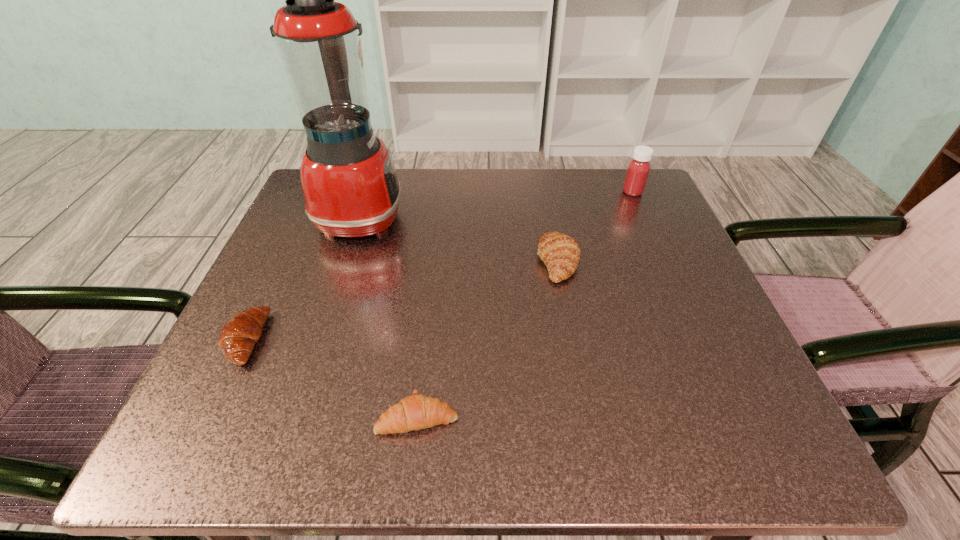
Image resolution: width=960 pixels, height=540 pixels. Identify the location of the tallest object. (349, 182).

Where is `medicine`? The height and width of the screenshot is (540, 960). medicine is located at coordinates (638, 169).

In order to click on the second tallest object in this screenshot , I will do `click(638, 169)`.

Image resolution: width=960 pixels, height=540 pixels. In order to click on the third shortest object in this screenshot , I will do `click(560, 253)`.

You are a GUI agent. You are given a task and a screenshot of the screen. Output one action in this format:
    pyautogui.click(x=<x>, y=<y>)
    Task: Click on the rightmost crescent roll
    The image size is (960, 540).
    Given the screenshot: What is the action you would take?
    click(560, 253)

Identify the location of the leftmost crescent roll. Image resolution: width=960 pixels, height=540 pixels. (240, 333).

You are a GUI agent. You are given a task and a screenshot of the screen. Output one action in this format:
    pyautogui.click(x=<x>, y=<y>)
    Task: Click on the second farthest crescent roll
    This screenshot has height=540, width=960.
    Given the screenshot: What is the action you would take?
    pyautogui.click(x=240, y=333)

Where is `the second crescent roll from left to right`? The image size is (960, 540). the second crescent roll from left to right is located at coordinates (415, 412).

The width and height of the screenshot is (960, 540). In order to click on the third object from right to left in this screenshot , I will do `click(415, 412)`.

You are a GUI agent. You are given a task and a screenshot of the screen. Output one action in this format:
    pyautogui.click(x=<x>, y=<y>)
    Task: Click on the vacant space located on the controls of the tallest object
    The width and height of the screenshot is (960, 540).
    Given the screenshot: What is the action you would take?
    pyautogui.click(x=473, y=217)